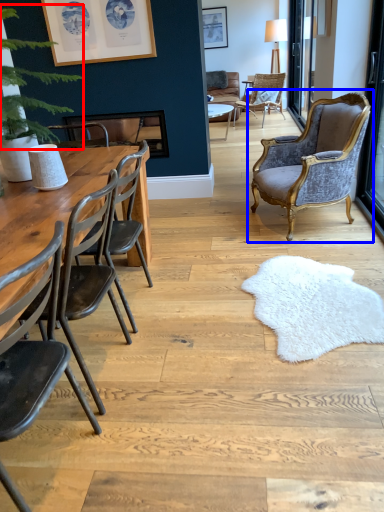
Question: Which point is closer to the camera, plant (highlighted by a red box) or chair (highlighted by a blue box)?

Choices:
 (A) plant
 (B) chair

Answer: (A)